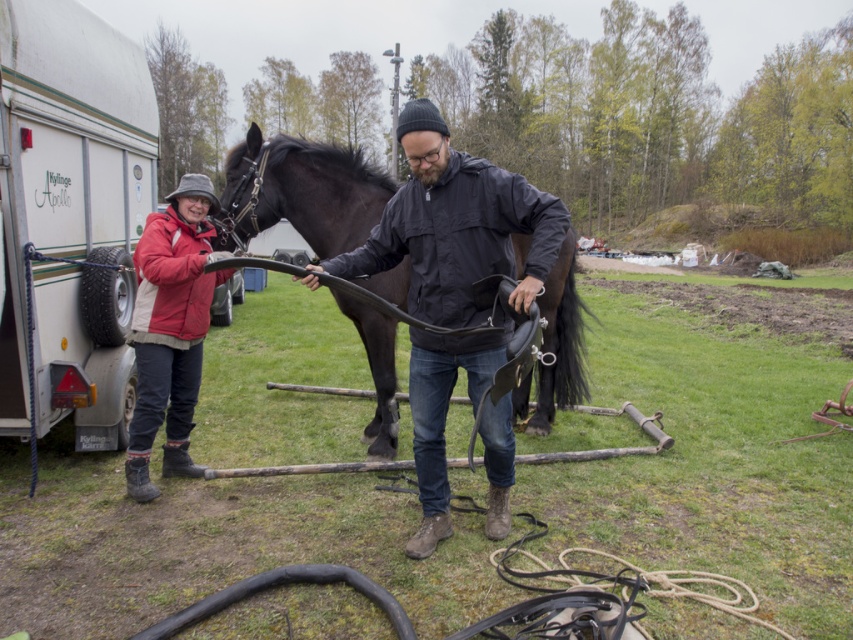
You are standing at the camera position and want to pick up an object located at point (22, 88). Can you reach it without moving your feet?

The point (22, 88) is 12.43 feet away from the camera, so you cannot reach it without moving your feet since it is too far.

You are a photographer standing in the middle of the field. You want to take a photo of the shiny black horse at center and the red woolen jacket at left. Which object should you focus on first if you want to capture both in the same frame without moving your camera?

The shiny black horse at center is not as tall as the red woolen jacket at left, so you should focus on the red woolen jacket at left first to ensure both are in focus.

You are standing in the field and see the shiny black horse at center and the red woolen jacket at left. Which object is higher in the image?

The shiny black horse at center is higher than the red woolen jacket at left.